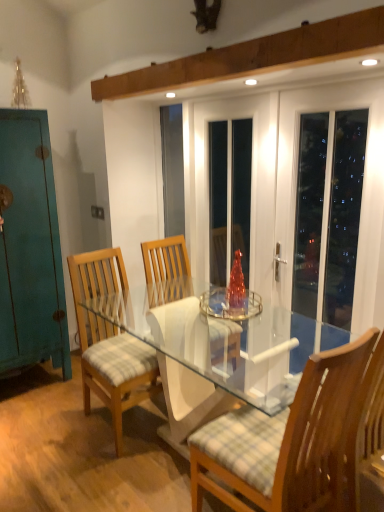
I want to click on vacant space underneath teal matte cabinet at left (from a real-world perspective), so click(28, 383).